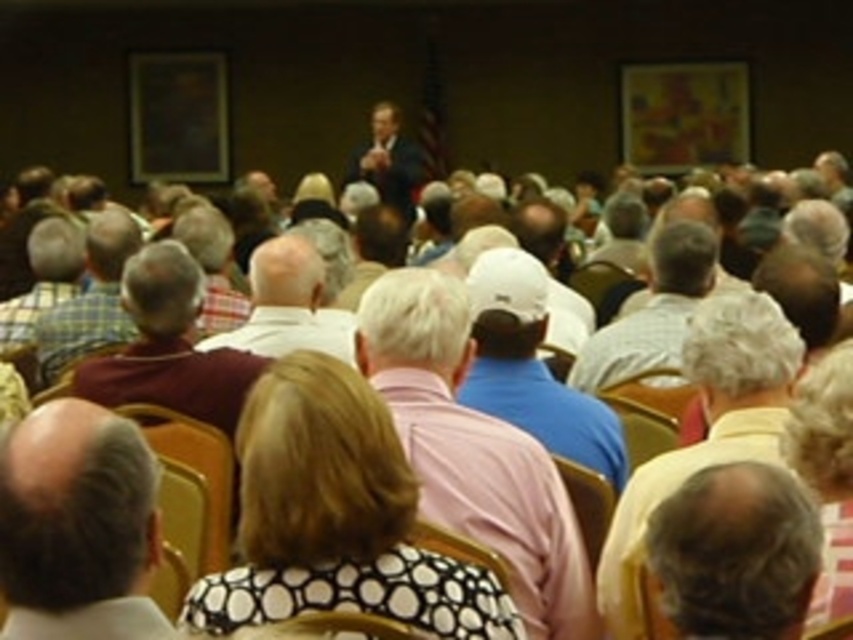
Question: Considering the real-world distances, which object is farthest from the light brown shirt at center?

Choices:
 (A) maroon shirt at center
 (B) white checkered shirt at center

Answer: (A)

Question: Can you confirm if white matte baseball cap at center is positioned to the left of gray hair at center?

Choices:
 (A) no
 (B) yes

Answer: (B)

Question: Among these objects, which one is nearest to the camera?

Choices:
 (A) gray hair at lower right
 (B) wooden chair at center
 (C) maroon shirt at center

Answer: (A)

Question: Which point is closer to the camera?

Choices:
 (A) gray hair at lower right
 (B) blue cotton shirt at center
 (C) wooden chair at center

Answer: (A)

Question: Can you confirm if gray hair at center is bigger than dark suit at center?

Choices:
 (A) no
 (B) yes

Answer: (A)

Question: Considering the relative positions of gray hair at center and gray cotton shirt at center in the image provided, where is gray hair at center located with respect to gray cotton shirt at center?

Choices:
 (A) above
 (B) below

Answer: (B)